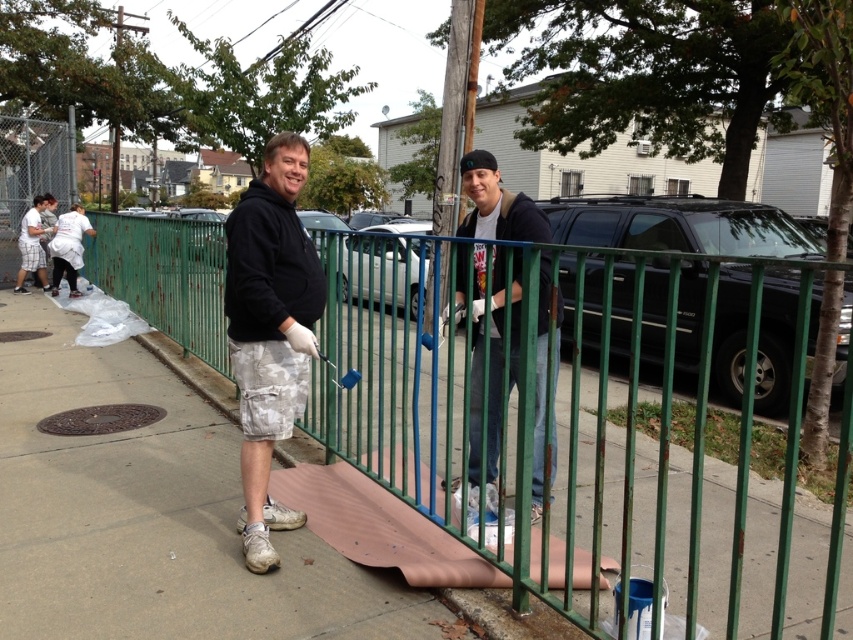
Question: Can you confirm if brown paper at center is positioned above matte black hoodie at center?

Choices:
 (A) no
 (B) yes

Answer: (A)

Question: Which is farther from the brown paper at center?

Choices:
 (A) black matte hoodie at center
 (B) green painted metal fence at center

Answer: (B)

Question: Is brown paper at center closer to the viewer compared to black matte hoodie at center?

Choices:
 (A) yes
 (B) no

Answer: (B)

Question: Does green painted metal fence at center appear on the left side of brown paper at center?

Choices:
 (A) yes
 (B) no

Answer: (B)

Question: Based on their relative distances, which object is farther from the black matte hoodie at center?

Choices:
 (A) matte black hoodie at center
 (B) brown paper at center

Answer: (B)

Question: Which is nearer to the matte black hoodie at center?

Choices:
 (A) black matte hoodie at center
 (B) brown paper at center
 (C) green painted metal fence at center

Answer: (A)